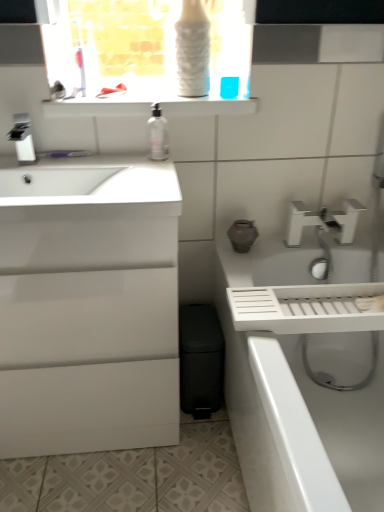
At what (x,y) coordinates should I click in order to perform the action: click on vacant area that is in front of clear plastic bottle at center. Please return your answer as a coordinate pair (x, y). This screenshot has height=512, width=384. Looking at the image, I should click on (148, 174).